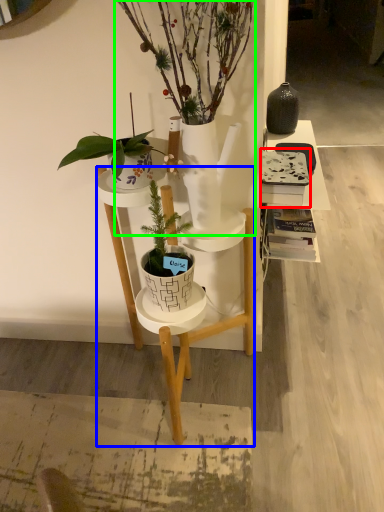
Question: Which is nearer to the book (highlighted by a red box)? desk (highlighted by a blue box) or houseplant (highlighted by a green box).

Choices:
 (A) desk
 (B) houseplant

Answer: (B)